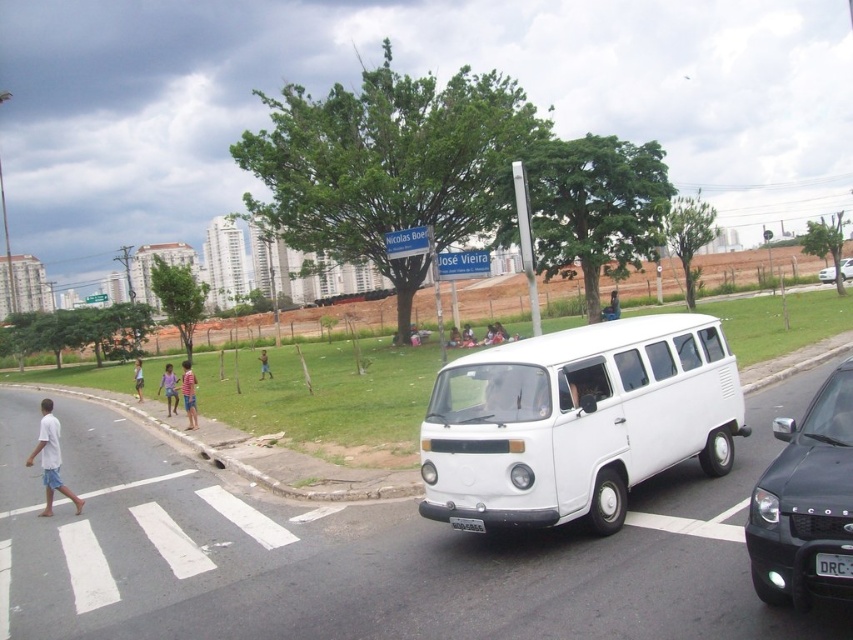
Question: Based on their relative distances, which object is nearer to the striped shirt at center?

Choices:
 (A) white matte van at center
 (B) white plastic license plate at center
 (C) dark brown leather jacket at center

Answer: (B)

Question: Which of the following is the farthest from the observer?

Choices:
 (A) black plastic license plate at center
 (B) black glossy suv at right
 (C) white cotton shirt at left
 (D) white plastic license plate at center

Answer: (C)

Question: Does dark brown leather jacket at center have a greater width compared to white plastic chair at center?

Choices:
 (A) yes
 (B) no

Answer: (A)

Question: Does white cotton shirt at left have a lesser width compared to dark brown leather jacket at center?

Choices:
 (A) no
 (B) yes

Answer: (A)

Question: Estimate the real-world distances between objects in this image. Which object is closer to the dark brown leather jacket at center?

Choices:
 (A) white matte van at center
 (B) light blue denim shorts at lower left
 (C) white plastic license plate at center
 (D) white cotton shirt at left

Answer: (B)

Question: Can you confirm if black glossy suv at right is thinner than light blue denim shorts at lower left?

Choices:
 (A) yes
 (B) no

Answer: (A)